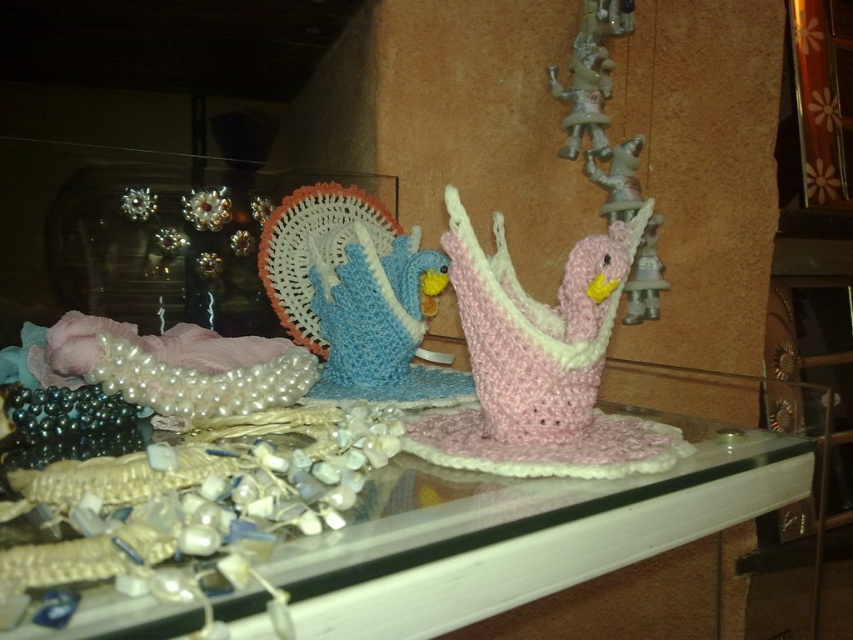
Question: Is translucent glass table at center in front of crochet blue bird at center?

Choices:
 (A) yes
 (B) no

Answer: (A)

Question: Is translucent glass table at center bigger than pink yarn duck at center?

Choices:
 (A) no
 (B) yes

Answer: (B)

Question: Which object is closer to the camera taking this photo?

Choices:
 (A) crochet blue bird at center
 (B) translucent glass table at center

Answer: (B)

Question: Which of these objects is positioned closest to the translucent glass table at center?

Choices:
 (A) crochet blue bird at center
 (B) pink yarn duck at center

Answer: (B)

Question: Is pink yarn duck at center below crochet blue bird at center?

Choices:
 (A) yes
 (B) no

Answer: (A)

Question: Based on their relative distances, which object is farther from the crochet blue bird at center?

Choices:
 (A) pink yarn duck at center
 (B) translucent glass table at center

Answer: (B)